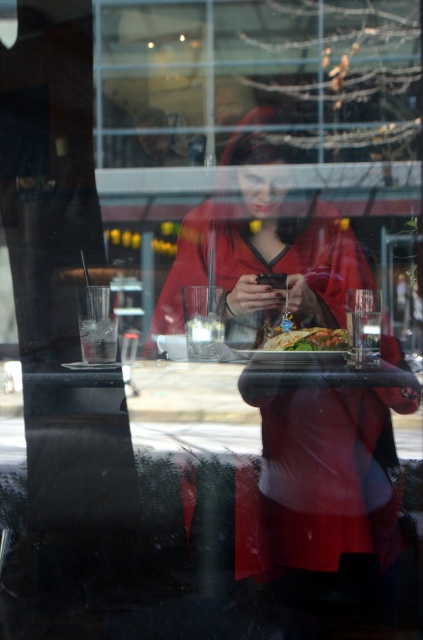
Does matte red coat at center appear on the left side of green leafy salad at center?

Indeed, matte red coat at center is positioned on the left side of green leafy salad at center.

Between matte red coat at center and green leafy salad at center, which one appears on the right side from the viewer's perspective?

From the viewer's perspective, green leafy salad at center appears more on the right side.

What do you see at coordinates (264, 244) in the screenshot? This screenshot has height=640, width=423. I see `matte red coat at center` at bounding box center [264, 244].

I want to click on matte red coat at center, so click(264, 244).

Does transparent glass window at upper center have a lesser width compared to matte red coat at center?

No, transparent glass window at upper center is not thinner than matte red coat at center.

Is point (302, 113) more distant than point (238, 170)?

No.

In order to click on transparent glass window at upper center in this screenshot , I will do `click(255, 77)`.

Does transparent glass window at upper center appear on the right side of green leafy salad at center?

In fact, transparent glass window at upper center is to the left of green leafy salad at center.

Does transparent glass window at upper center have a greater width compared to green leafy salad at center?

Yes.

Who is more forward, (406, 16) or (321, 348)?

Point (406, 16) is in front.

Where is `transparent glass window at upper center`? transparent glass window at upper center is located at coordinates (255, 77).